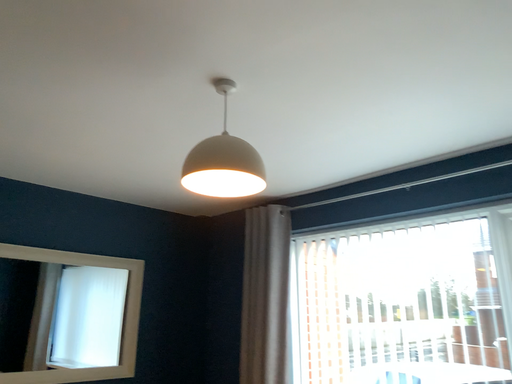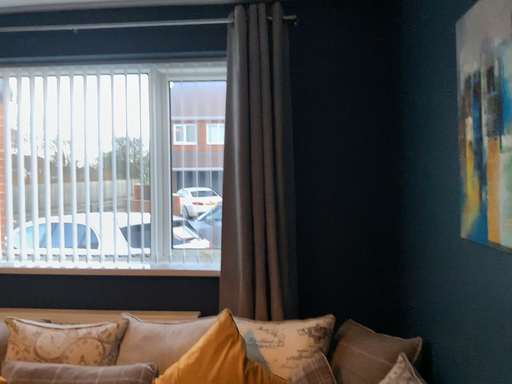
Question: Which way did the camera rotate in the video?

Choices:
 (A) rotated downward
 (B) rotated upward

Answer: (A)